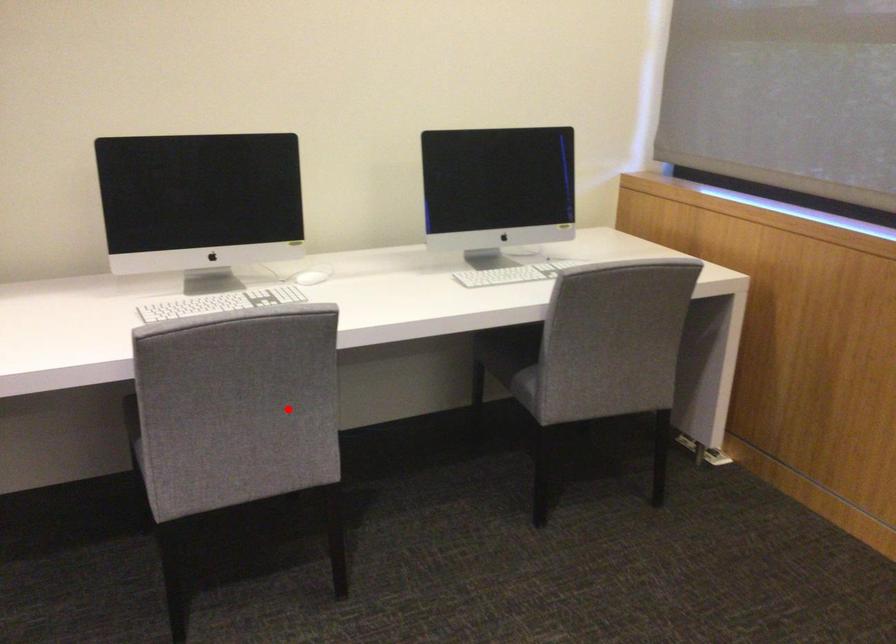
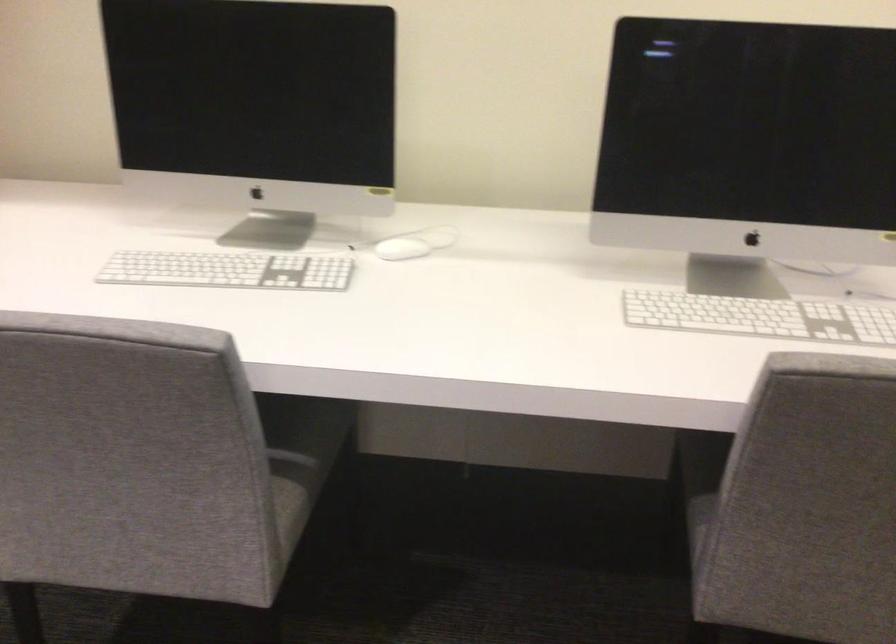
Question: I am providing you with two images of the same scene from different viewpoints. Image1 has a red point marked. In image2, the corresponding 3D location appears at what relative position? Reply with the corresponding letter.

Choices:
 (A) Closer
 (B) Farther

Answer: (A)